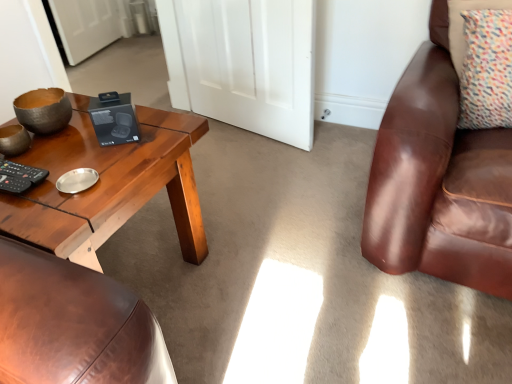
What do you see at coordinates (108, 185) in the screenshot?
I see `woodenmaterial/texturecoffee table at left` at bounding box center [108, 185].

Where is `woodenmaterial/texturecoffee table at left`? woodenmaterial/texturecoffee table at left is located at coordinates (108, 185).

From the image's perspective, would you say white matte door at center is positioned over multicolored fabric pillow at upper right?

Yes, from the image's perspective, white matte door at center is above multicolored fabric pillow at upper right.

Does white matte door at center contain multicolored fabric pillow at upper right?

Actually, multicolored fabric pillow at upper right is outside white matte door at center.

Is point (245, 38) closer to viewer compared to point (470, 83)?

That is False.

Is white matte door at center turned away from multicolored fabric pillow at upper right?

No, white matte door at center is not facing the opposite direction of multicolored fabric pillow at upper right.

Is point (275, 32) farther from viewer compared to point (99, 167)?

That is True.

Does white matte door at center have a lesser width compared to woodenmaterial/texturecoffee table at left?

Yes.

From the picture: How far apart are white matte door at center and woodenmaterial/texturecoffee table at left?

white matte door at center is 92.30 centimeters from woodenmaterial/texturecoffee table at left.

Between white matte door at center and woodenmaterial/texturecoffee table at left, which one appears on the right side from the viewer's perspective?

white matte door at center.

Considering the positions of objects woodenmaterial/texturecoffee table at left and multicolored fabric pillow at upper right in the image provided, who is more to the right, woodenmaterial/texturecoffee table at left or multicolored fabric pillow at upper right?

Positioned to the right is multicolored fabric pillow at upper right.

Identify the location of pillow above the woodenmaterial/texturecoffee table at left (from a real-world perspective). (487, 70).

In the scene shown: Is there a large distance between woodenmaterial/texturecoffee table at left and multicolored fabric pillow at upper right?

Yes.

Based on the photo, who is taller, multicolored fabric pillow at upper right or white matte door at center?

With more height is white matte door at center.

Is multicolored fabric pillow at upper right oriented towards white matte door at center?

No, multicolored fabric pillow at upper right is not turned towards white matte door at center.

From a real-world perspective, between multicolored fabric pillow at upper right and white matte door at center, who is vertically lower?

white matte door at center is physically lower.

Does woodenmaterial/texturecoffee table at left appear on the left side of white matte door at center?

Yes, woodenmaterial/texturecoffee table at left is to the left of white matte door at center.

Considering the relative sizes of woodenmaterial/texturecoffee table at left and white matte door at center in the image provided, is woodenmaterial/texturecoffee table at left thinner than white matte door at center?

Incorrect, the width of woodenmaterial/texturecoffee table at left is not less than that of white matte door at center.

At what (x,y) coordinates should I click in order to perform the action: click on coffee table in front of the white matte door at center. Please return your answer as a coordinate pair (x, y). The width and height of the screenshot is (512, 384). Looking at the image, I should click on (108, 185).

Image resolution: width=512 pixels, height=384 pixels. Find the location of `coffee table below the multicolored fabric pillow at upper right (from a real-world perspective)`. coffee table below the multicolored fabric pillow at upper right (from a real-world perspective) is located at coordinates (108, 185).

From a real-world perspective, does multicolored fabric pillow at upper right sit lower than woodenmaterial/texturecoffee table at left?

Incorrect, from a real-world perspective, multicolored fabric pillow at upper right is higher than woodenmaterial/texturecoffee table at left.

Choose the correct answer: Is multicolored fabric pillow at upper right inside woodenmaterial/texturecoffee table at left or outside it?

multicolored fabric pillow at upper right cannot be found inside woodenmaterial/texturecoffee table at left.

Could you tell me if multicolored fabric pillow at upper right is turned towards woodenmaterial/texturecoffee table at left?

No, multicolored fabric pillow at upper right is not oriented towards woodenmaterial/texturecoffee table at left.

What are the coordinates of `door that appears above the multicolored fabric pillow at upper right (from the image's perspective)` in the screenshot? It's located at (251, 64).

Where is `coffee table below the white matte door at center (from a real-world perspective)`? The image size is (512, 384). coffee table below the white matte door at center (from a real-world perspective) is located at coordinates (108, 185).

From the image, which object appears to be nearer to multicolored fabric pillow at upper right, white matte door at center or woodenmaterial/texturecoffee table at left?

The object closer to multicolored fabric pillow at upper right is white matte door at center.

Considering their positions, is multicolored fabric pillow at upper right positioned closer to white matte door at center than woodenmaterial/texturecoffee table at left?

woodenmaterial/texturecoffee table at left lies closer to white matte door at center than the other object.

Estimate the real-world distances between objects in this image. Which object is further from white matte door at center, woodenmaterial/texturecoffee table at left or multicolored fabric pillow at upper right?

multicolored fabric pillow at upper right is further to white matte door at center.

Which object lies further to the anchor point woodenmaterial/texturecoffee table at left, white matte door at center or multicolored fabric pillow at upper right?

multicolored fabric pillow at upper right is positioned further to the anchor woodenmaterial/texturecoffee table at left.

Which object lies further to the anchor point multicolored fabric pillow at upper right, woodenmaterial/texturecoffee table at left or white matte door at center?

woodenmaterial/texturecoffee table at left is positioned further to the anchor multicolored fabric pillow at upper right.

When comparing their distances from woodenmaterial/texturecoffee table at left, does multicolored fabric pillow at upper right or white matte door at center seem closer?

The object closer to woodenmaterial/texturecoffee table at left is white matte door at center.

Where is `door between woodenmaterial/texturecoffee table at left and multicolored fabric pillow at upper right from left to right`? door between woodenmaterial/texturecoffee table at left and multicolored fabric pillow at upper right from left to right is located at coordinates (251, 64).